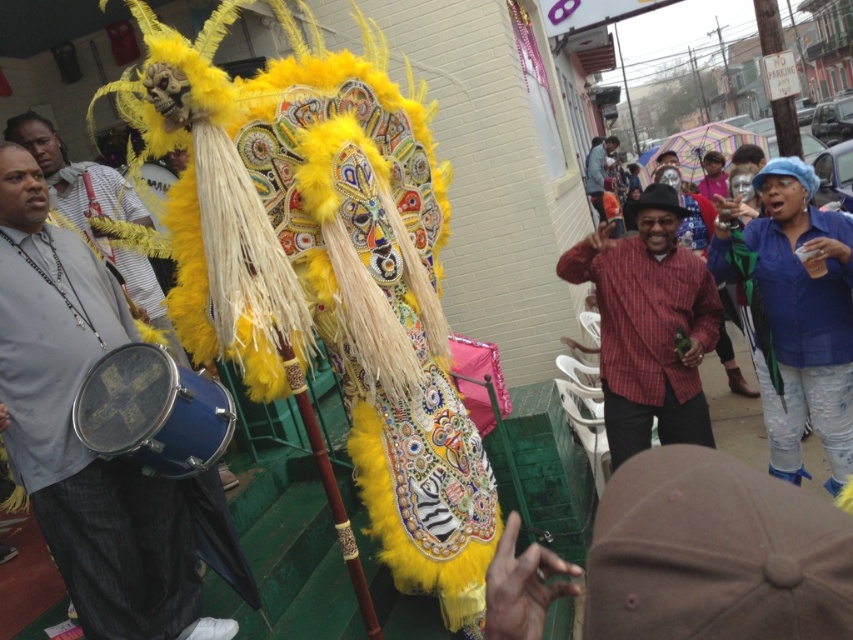
You are a photographer at the event and want to capture a photo of the blue denim jeans at lower right without the matte blue drum at center appearing in the frame. Is this possible based on their positions?

The matte blue drum at center is positioned on the left side of blue denim jeans at lower right. To avoid including the drum in the photo, the photographer should frame the shot so that the blue denim jeans at lower right are centered and ensure the left edge of the frame does not include the drum.

You are a photographer trying to capture the entire scene in one shot. The blue denim jeans at lower right and the feathered yellow costume at center are both in your frame. Which object appears narrower in your photo?

The blue denim jeans at lower right appears narrower in the photo because it is thinner than the feathered yellow costume at center.